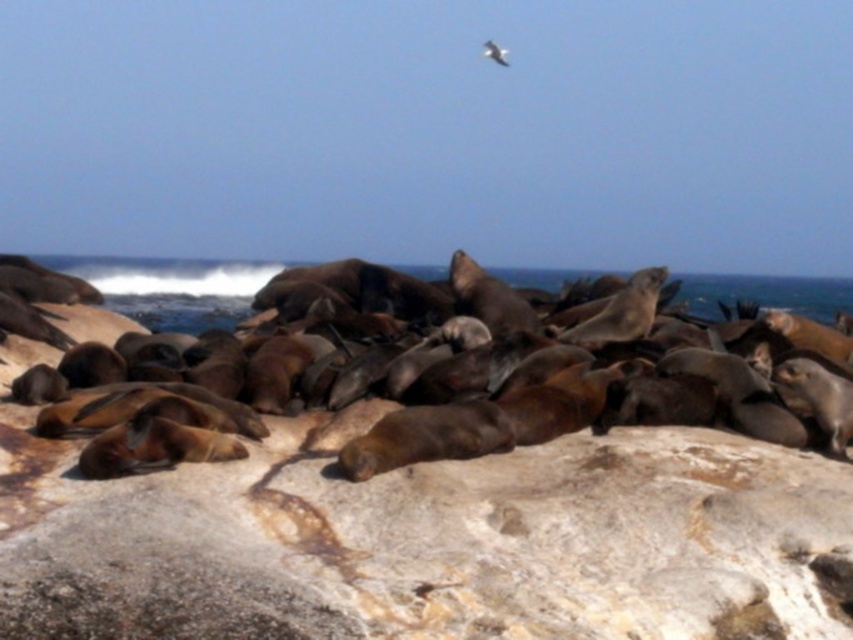
Is brown rough rock at center positioned at the back of brown fur seals at center?

No, it is in front of brown fur seals at center.

Who is more distant from viewer, (173, 552) or (83, 269)?

The point (83, 269) is more distant.

What do you see at coordinates (427, 540) in the screenshot? This screenshot has height=640, width=853. I see `brown rough rock at center` at bounding box center [427, 540].

Find the location of a particular element. brown rough rock at center is located at coordinates (427, 540).

Is brown rough rock at center wider than white feathered bird at upper center?

Indeed, brown rough rock at center has a greater width compared to white feathered bird at upper center.

Is brown rough rock at center positioned before white feathered bird at upper center?

Yes, brown rough rock at center is in front of white feathered bird at upper center.

Is point (105, 632) positioned behind point (496, 54)?

No, (105, 632) is closer to viewer.

Where is `brown rough rock at center`? This screenshot has height=640, width=853. brown rough rock at center is located at coordinates pyautogui.click(x=427, y=540).

Between point (109, 259) and point (486, 52), which one is positioned behind?

The point (109, 259) is more distant.

At what (x,y) coordinates should I click in order to perform the action: click on brown fur seals at center. Please return your answer as a coordinate pair (x, y). Looking at the image, I should click on (171, 288).

What do you see at coordinates (171, 288) in the screenshot? This screenshot has width=853, height=640. I see `brown fur seals at center` at bounding box center [171, 288].

Identify the location of brown fur seals at center. (171, 288).